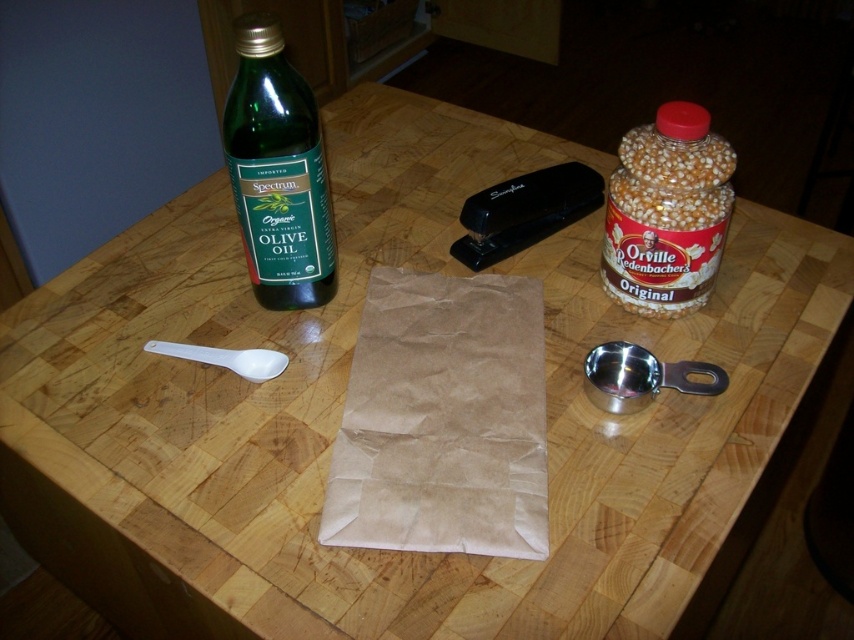
You are a chef preparing a dish and need to reach for the white plastic spoon at left and the translucent plastic popcorn container at right. If your arm can only extend 15 inches, will you be able to grab both items without moving your body?

The distance between the translucent plastic popcorn container at right and the white plastic spoon at left is 15.77 inches. Since your arm can only extend 15 inches, you won